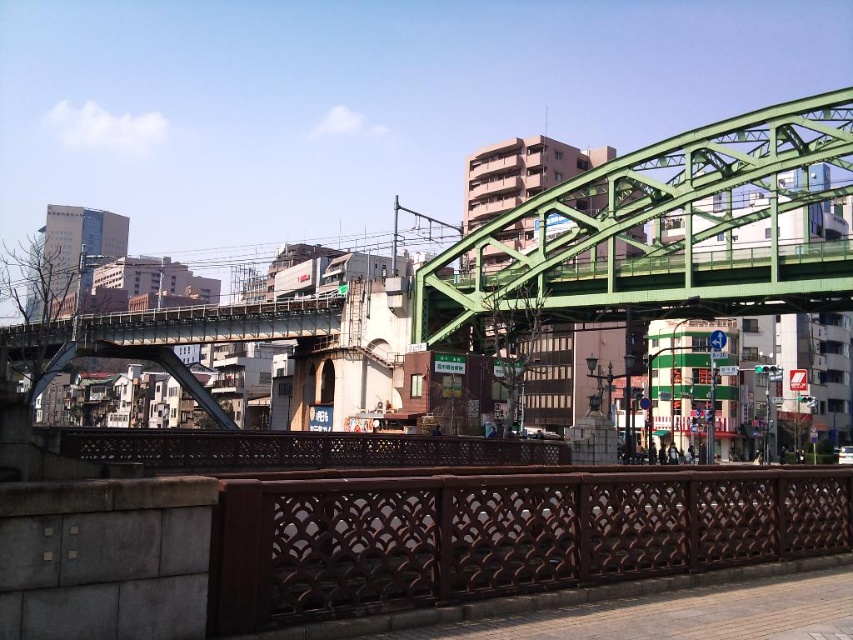
Who is shorter, green metallic bridge at upper center or brown wooden rail at center?

brown wooden rail at center

Can you confirm if green metallic bridge at upper center is wider than brown wooden rail at center?

Yes, green metallic bridge at upper center is wider than brown wooden rail at center.

What do you see at coordinates (666, 230) in the screenshot? The image size is (853, 640). I see `green metallic bridge at upper center` at bounding box center [666, 230].

This screenshot has width=853, height=640. I want to click on green metallic bridge at upper center, so click(666, 230).

The height and width of the screenshot is (640, 853). Identify the location of brown textured rail at lower center. (500, 534).

Is brown textured rail at lower center closer to the viewer compared to green metallic bridge at upper center?

Yes.

What do you see at coordinates (500, 534) in the screenshot? This screenshot has width=853, height=640. I see `brown textured rail at lower center` at bounding box center [500, 534].

The width and height of the screenshot is (853, 640). Identify the location of brown textured rail at lower center. (500, 534).

What do you see at coordinates (500, 534) in the screenshot? The height and width of the screenshot is (640, 853). I see `brown textured rail at lower center` at bounding box center [500, 534].

Which is behind, point (502, 524) or point (514, 461)?

Point (514, 461)

This screenshot has height=640, width=853. I want to click on brown textured rail at lower center, so click(500, 534).